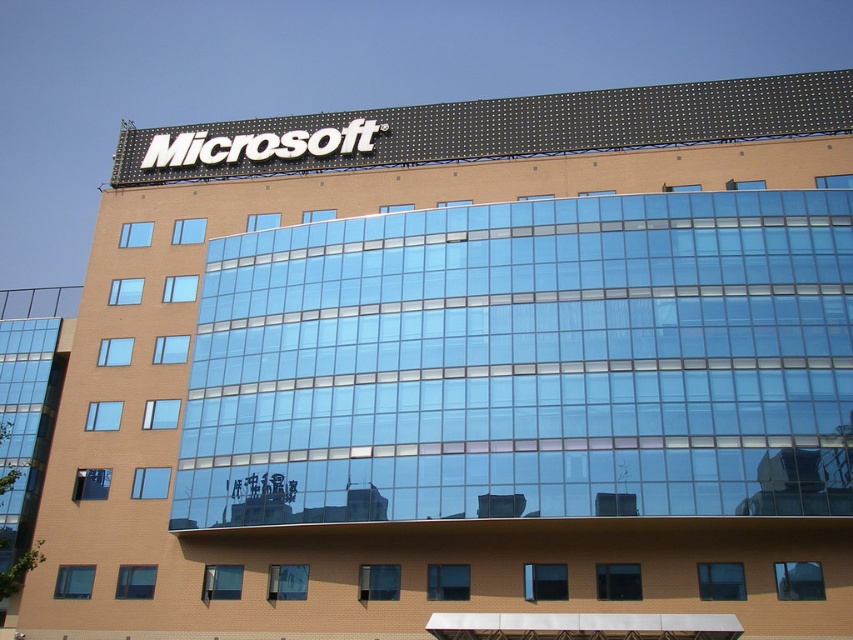
You are standing in front of the Microsoft office building. There is a point labeled as point (527, 364). Based on the description, where is this point located on the building?

The point (527, 364) is located on the transparent glass building at center, which is the upper portion of the Microsoft office building with the illuminated sign.